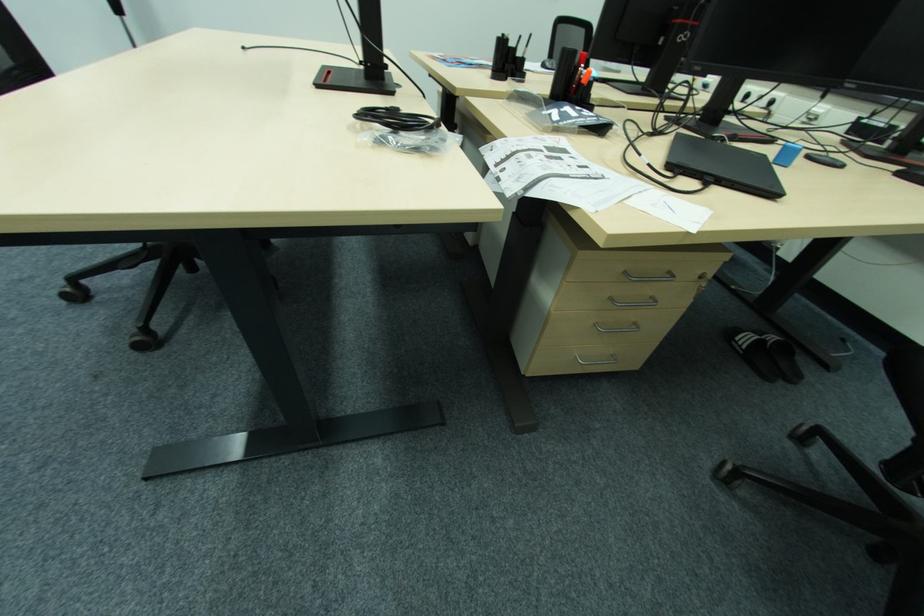
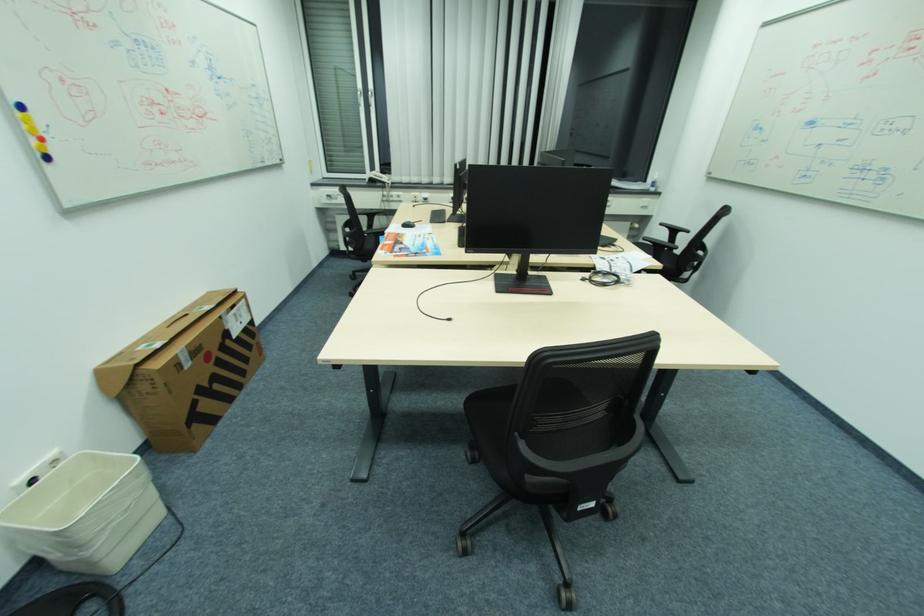
The point at (699,232) is marked in the first image. Where is the corresponding point in the second image?

(657, 257)